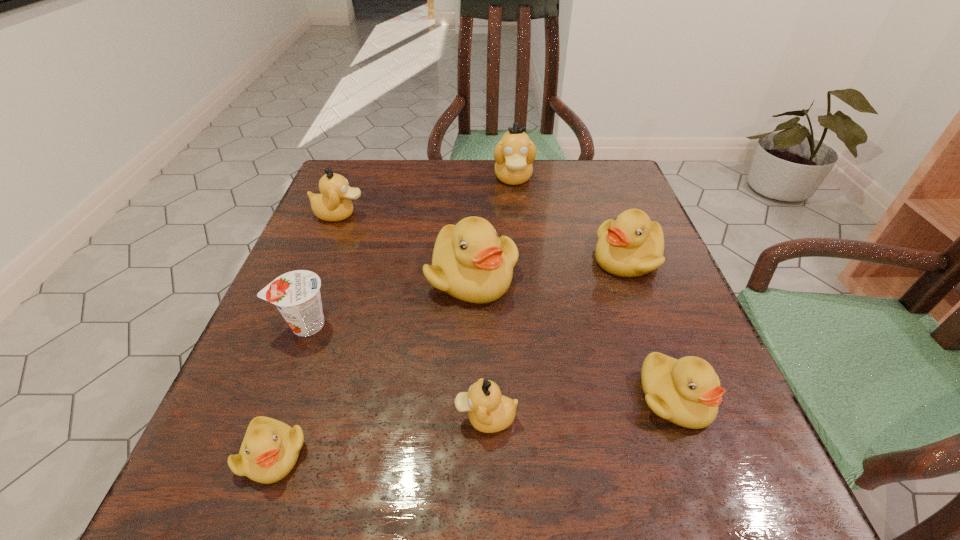
This screenshot has height=540, width=960. Identify the location of the shortest duckling. (270, 449).

Locate an element on the screen. vacant region located on the face of the biggest tan duckling is located at coordinates (528, 315).

Locate an element on the screen. This screenshot has width=960, height=540. free space located 0.260m on the front-facing side of the biggest yellow duckling is located at coordinates (468, 443).

Identify the location of vacant space situated on the face of the second farthest tan duckling. The height and width of the screenshot is (540, 960). (460, 214).

Image resolution: width=960 pixels, height=540 pixels. In order to click on vacant position located 0.230m on the front-facing side of the second biggest yellow duckling in this screenshot , I will do `click(482, 259)`.

The height and width of the screenshot is (540, 960). Find the location of `free region located 0.130m on the front-facing side of the second biggest yellow duckling`. free region located 0.130m on the front-facing side of the second biggest yellow duckling is located at coordinates (530, 259).

Locate an element on the screen. free space located on the front-facing side of the second biggest yellow duckling is located at coordinates [x=530, y=259].

Image resolution: width=960 pixels, height=540 pixels. What are the coordinates of `vacant region located 0.060m on the front-facing side of the third biggest yellow duckling` in the screenshot? It's located at (704, 475).

This screenshot has width=960, height=540. Identify the location of vacant space located on the back of the yogurt. (342, 228).

I want to click on free space located on the face of the smallest tan duckling, so click(292, 418).